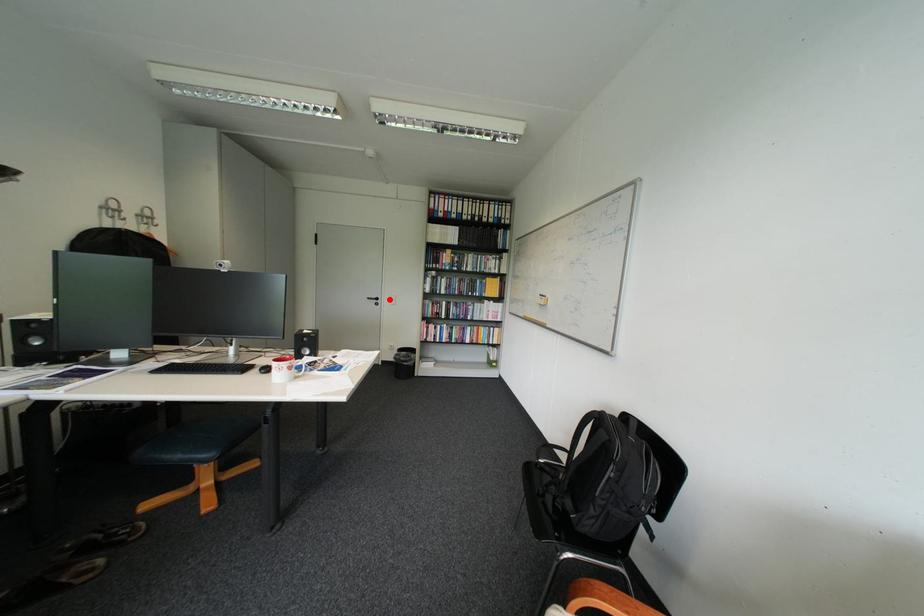
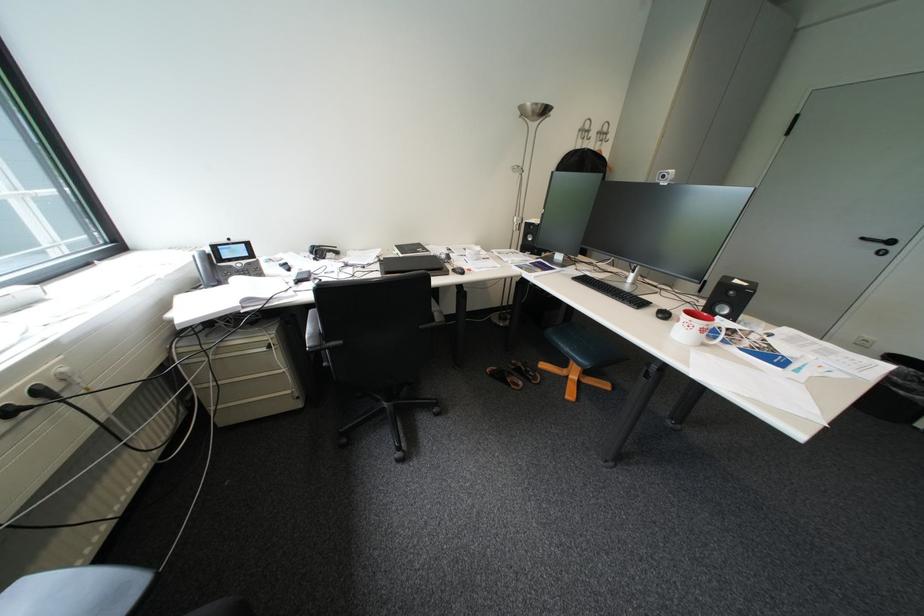
Question: I am providing you with two images of the same scene from different viewpoints. A red point is shown in image1. For the corresponding object point in image2, is it positioned nearer or farther from the camera?

Choices:
 (A) Nearer
 (B) Farther

Answer: (B)